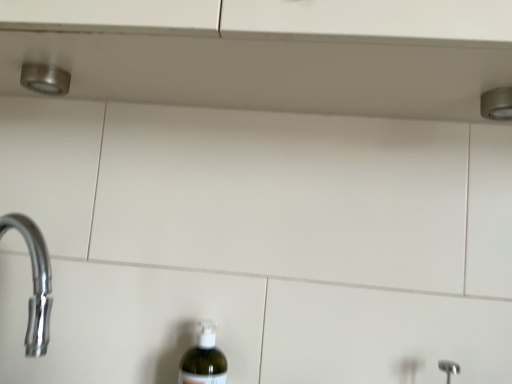
Question: From the image's perspective, is satin nickel shower at upper right positioned above or below translucent plastic bottle at lower center?

Choices:
 (A) below
 (B) above

Answer: (B)

Question: Does point pyautogui.click(x=492, y=89) appear closer or farther from the camera than point pyautogui.click(x=218, y=375)?

Choices:
 (A) closer
 (B) farther

Answer: (A)

Question: Relative to translucent plastic bottle at lower center, is satin nickel shower at upper right in front or behind?

Choices:
 (A) behind
 (B) front

Answer: (B)

Question: Does point (214, 372) appear closer or farther from the camera than point (493, 110)?

Choices:
 (A) closer
 (B) farther

Answer: (B)

Question: From a real-world perspective, relative to satin nickel shower at upper right, is translucent plastic bottle at lower center vertically above or below?

Choices:
 (A) above
 (B) below

Answer: (B)

Question: Based on their sizes in the image, would you say translucent plastic bottle at lower center is bigger or smaller than satin nickel shower at upper right?

Choices:
 (A) small
 (B) big

Answer: (B)

Question: Considering their positions, is translucent plastic bottle at lower center located in front of or behind satin nickel shower at upper right?

Choices:
 (A) front
 (B) behind

Answer: (B)